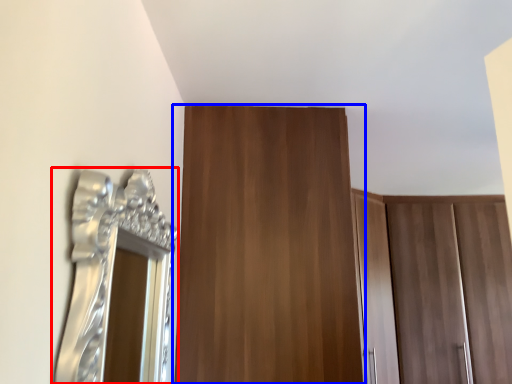
Question: Which point is closer to the camera, mirror (highlighted by a red box) or door (highlighted by a blue box)?

Choices:
 (A) mirror
 (B) door

Answer: (A)